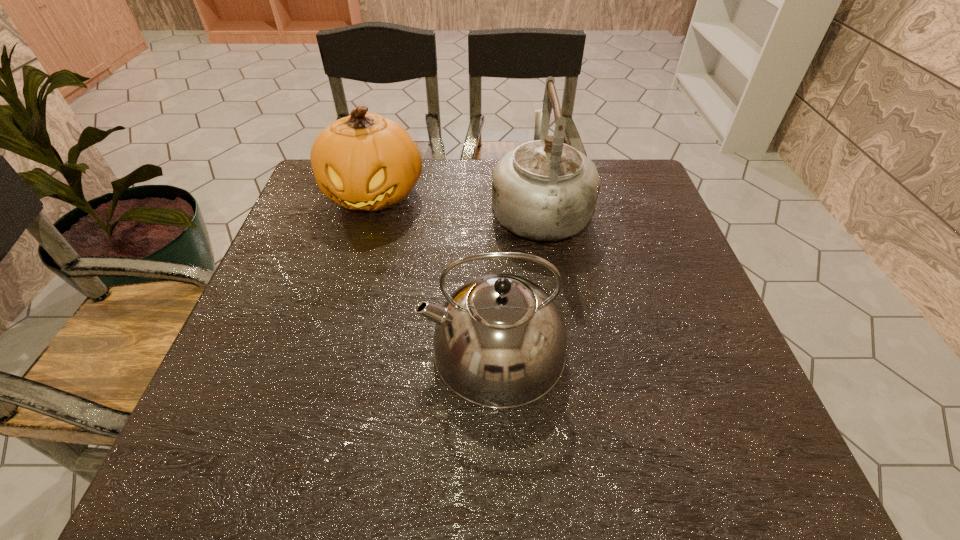
This screenshot has height=540, width=960. I want to click on the tallest object, so [x=545, y=190].

Find the location of a particular element. The width and height of the screenshot is (960, 540). the farther kettle is located at coordinates (545, 190).

At what (x,y) coordinates should I click in order to perform the action: click on the leftmost object. Please return your answer as a coordinate pair (x, y). Looking at the image, I should click on (364, 161).

Locate an element on the screen. the shorter kettle is located at coordinates (500, 341).

Where is `the nearer kettle`? The height and width of the screenshot is (540, 960). the nearer kettle is located at coordinates (500, 341).

Where is `vacant space located 0.200m on the front face of the pumpkin`? This screenshot has height=540, width=960. vacant space located 0.200m on the front face of the pumpkin is located at coordinates (348, 285).

Find the location of a particular element. free location located 0.220m from the spout of the nearest object is located at coordinates (308, 349).

The height and width of the screenshot is (540, 960). In order to click on vacant region located from the spout of the nearest object in this screenshot , I will do `click(395, 349)`.

Identify the location of vacant space located from the spout of the nearest object. This screenshot has width=960, height=540. (390, 349).

You are a GUI agent. You are given a task and a screenshot of the screen. Output one action in this format:
    pyautogui.click(x=<x>, y=<y>)
    Task: Click on the kettle situated at the far edge
    The width and height of the screenshot is (960, 540).
    Given the screenshot: What is the action you would take?
    pyautogui.click(x=545, y=190)